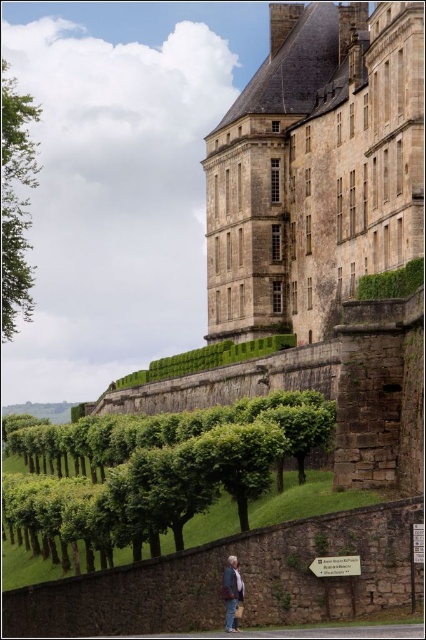
Who is positioned more to the left, green leafy tree at center or green leafy tree at left?

green leafy tree at left

Who is higher up, green leafy tree at center or green leafy tree at left?

Positioned higher is green leafy tree at left.

Who is more forward, (52,548) or (8,259)?

Positioned in front is point (52,548).

You are a GUI agent. You are given a task and a screenshot of the screen. Output one action in this format:
    pyautogui.click(x=<x>, y=<y>)
    Task: Click on the green leafy tree at center
    This screenshot has height=640, width=426.
    Given the screenshot: What is the action you would take?
    pyautogui.click(x=157, y=468)

Which is below, brown stone castle at upper center or brown leather jacket at lower center?

Positioned lower is brown leather jacket at lower center.

Between brown stone castle at upper center and brown leather jacket at lower center, which one is positioned higher?

Positioned higher is brown stone castle at upper center.

Is point (331, 116) farther from camera compared to point (235, 612)?

Yes, it is behind point (235, 612).

Identify the location of brown stone castle at upper center. This screenshot has width=426, height=640. (316, 166).

Is brown stone castle at center thinner than green leafy hedge at center?

Incorrect, brown stone castle at center's width is not less than green leafy hedge at center's.

Is the position of brown stone castle at center less distant than that of green leafy hedge at center?

Yes, brown stone castle at center is closer to the viewer.

Is point (267, 323) closer to viewer compared to point (376, 292)?

No, (267, 323) is further to viewer.

Image resolution: width=426 pixels, height=640 pixels. I want to click on brown stone castle at center, so click(x=319, y=230).